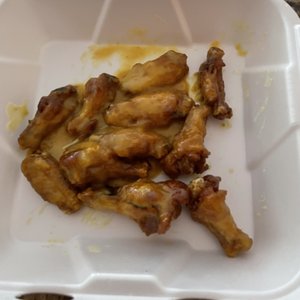
Locate an element on the screen. The height and width of the screenshot is (300, 300). tray is located at coordinates (253, 274).